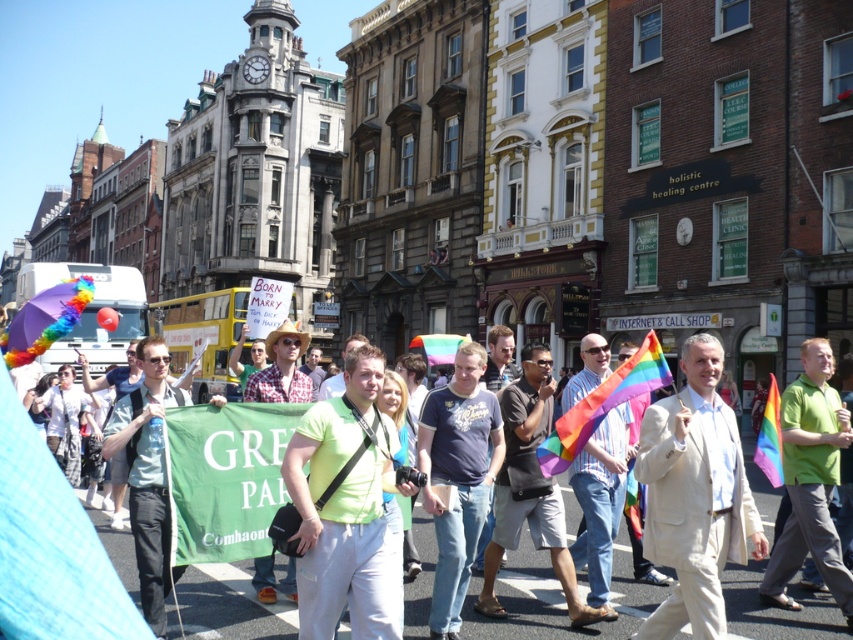
Is white textured suit at center smaller than green matte shirt at center?

Correct, white textured suit at center occupies less space than green matte shirt at center.

Does white textured suit at center have a lesser height compared to green matte shirt at center?

In fact, white textured suit at center may be taller than green matte shirt at center.

Between point (694, 561) and point (798, 512), which one is positioned in front?

Point (694, 561) is in front.

This screenshot has width=853, height=640. In order to click on white textured suit at center in this screenshot , I will do `click(695, 496)`.